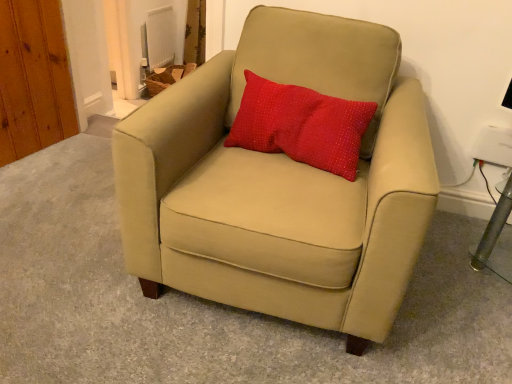
In order to click on vacant position to the left of suede beige armchair at center in this screenshot , I will do `click(63, 230)`.